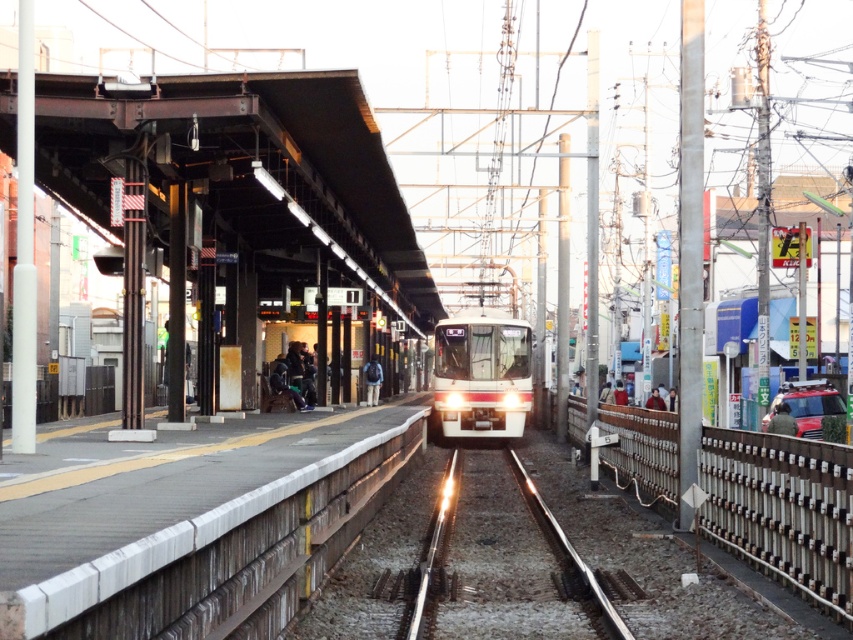
You are a maintenance worker needing to cross from the concrete platform at center to the white metal fence at right. Given that your tool cart requires at least 6 meters of clearance, will you be able to pass through the space between them?

The concrete platform at center and white metal fence at right are 6.31 meters apart, which is more than the required 6 meters of clearance. Therefore, the tool cart can pass through the space between them.

You are standing at point (367, 394) on the train station platform. You want to walk to point (485, 456). According to the scene description, which direction should you face to move towards your destination?

You should face forward because point (485, 456) is in front of point (367, 394).

You are a maintenance worker on the train platform. You need to inspect the metallic silver train track at center. However, there is a white glossy train at center blocking your path. Can you access the track without moving the train?

The metallic silver train track at center is positioned under the white glossy train at center, so the train is directly on top of the track. This means you cannot access the track without moving the train since it is currently blocking the track.